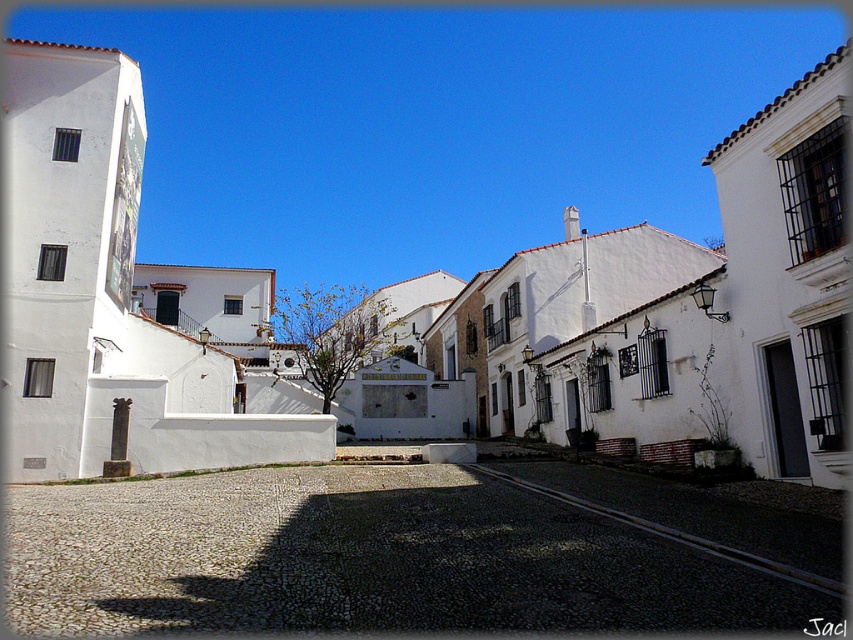
Question: Is gray cobblestone alley at center to the right of white matte building at center from the viewer's perspective?

Choices:
 (A) yes
 (B) no

Answer: (B)

Question: Which of the following is the closest to the observer?

Choices:
 (A) (4, 556)
 (B) (71, 301)

Answer: (A)

Question: Observing the image, what is the correct spatial positioning of gray cobblestone alley at center in reference to white matte building at center?

Choices:
 (A) right
 (B) left

Answer: (B)

Question: Considering the relative positions of gray cobblestone alley at center and white matte building at center in the image provided, where is gray cobblestone alley at center located with respect to white matte building at center?

Choices:
 (A) above
 (B) below

Answer: (B)